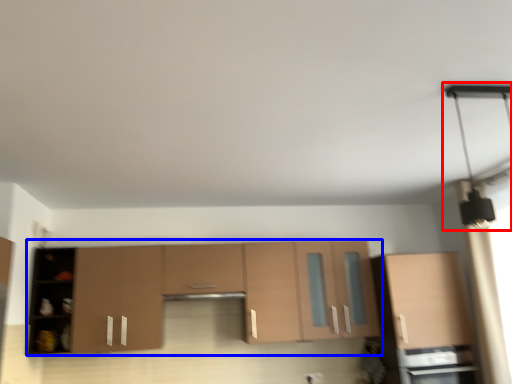
Question: Among these objects, which one is farthest to the camera, light fixture (highlighted by a red box) or cabinetry (highlighted by a blue box)?

Choices:
 (A) light fixture
 (B) cabinetry

Answer: (B)